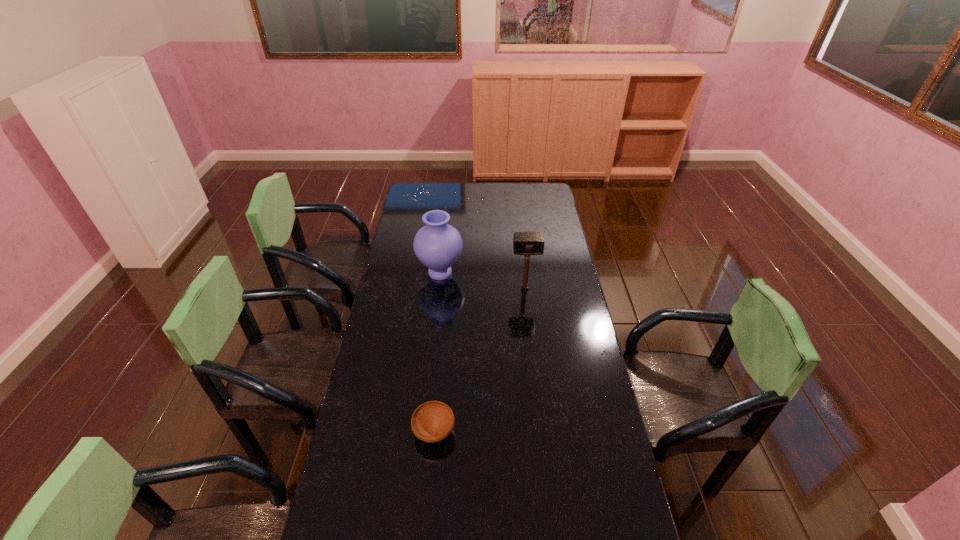
At what (x,y) coordinates should I click in order to perform the action: click on vase. Please return your answer as a coordinate pair (x, y). Looking at the image, I should click on (438, 245).

Find the location of a particular element. This screenshot has height=540, width=960. mallet is located at coordinates (524, 243).

The height and width of the screenshot is (540, 960). What are the coordinates of `the nearest object` in the screenshot? It's located at (433, 421).

The width and height of the screenshot is (960, 540). In order to click on the shortest object in this screenshot , I will do `click(433, 421)`.

At what (x,y) coordinates should I click in order to perform the action: click on free space located on the back of the vase. Please return your answer as a coordinate pair (x, y). Image resolution: width=960 pixels, height=540 pixels. Looking at the image, I should click on point(445,224).

The width and height of the screenshot is (960, 540). I want to click on vacant point located on the front of the mallet, so click(x=528, y=316).

I want to click on vacant space located 0.080m on the left of the nearest object, so click(x=389, y=431).

At what (x,y) coordinates should I click in order to perform the action: click on object that is at the left edge. Please return your answer as a coordinate pair (x, y). Image resolution: width=960 pixels, height=540 pixels. Looking at the image, I should click on (438, 245).

I want to click on free space at the far edge, so click(x=497, y=187).

Locate an element on the screen. vacant area at the left edge of the desktop is located at coordinates 396,234.